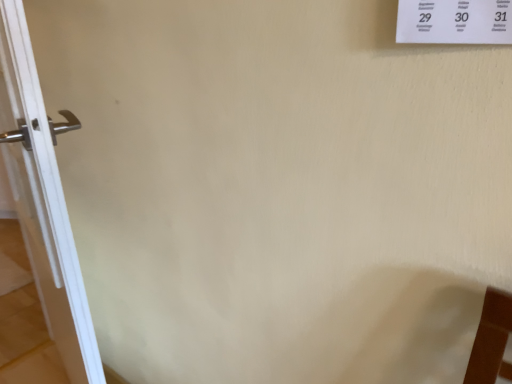
Question: Relative to white glossy door handle at left, is white paper at upper right in front or behind?

Choices:
 (A) behind
 (B) front

Answer: (B)

Question: From the image's perspective, relative to white glossy door handle at left, is white paper at upper right above or below?

Choices:
 (A) below
 (B) above

Answer: (B)

Question: Based on their sizes in the image, would you say white paper at upper right is bigger or smaller than white glossy door handle at left?

Choices:
 (A) big
 (B) small

Answer: (B)

Question: From the image's perspective, relative to white paper at upper right, is white glossy door handle at left above or below?

Choices:
 (A) above
 (B) below

Answer: (B)

Question: Considering the positions of white glossy door handle at left and white paper at upper right in the image, is white glossy door handle at left wider or thinner than white paper at upper right?

Choices:
 (A) thin
 (B) wide

Answer: (B)

Question: Looking at the image, does white glossy door handle at left seem bigger or smaller compared to white paper at upper right?

Choices:
 (A) big
 (B) small

Answer: (A)

Question: Considering the relative positions of white glossy door handle at left and white paper at upper right in the image provided, is white glossy door handle at left to the left or to the right of white paper at upper right?

Choices:
 (A) right
 (B) left

Answer: (B)